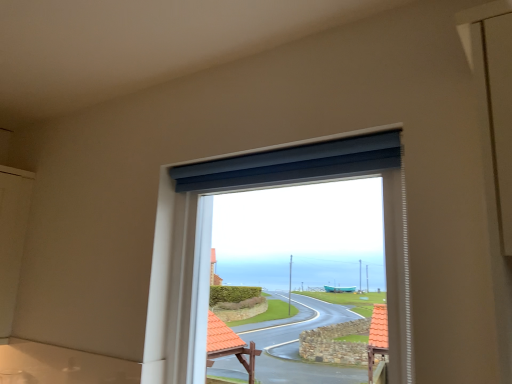
Question: In the image, is matte blue roller blind at center positioned in front of or behind matte blue curtain at upper center?

Choices:
 (A) behind
 (B) front

Answer: (B)

Question: Is matte blue roller blind at center taller or shorter than matte blue curtain at upper center?

Choices:
 (A) tall
 (B) short

Answer: (A)

Question: Is point (401, 326) positioned closer to the camera than point (185, 178)?

Choices:
 (A) closer
 (B) farther

Answer: (A)

Question: Would you say matte blue curtain at upper center is to the left or to the right of matte blue roller blind at center in the picture?

Choices:
 (A) left
 (B) right

Answer: (A)

Question: In terms of width, does matte blue curtain at upper center look wider or thinner when compared to matte blue roller blind at center?

Choices:
 (A) wide
 (B) thin

Answer: (B)

Question: Considering the positions of matte blue curtain at upper center and matte blue roller blind at center in the image, is matte blue curtain at upper center taller or shorter than matte blue roller blind at center?

Choices:
 (A) tall
 (B) short

Answer: (B)

Question: Is point pyautogui.click(x=361, y=137) closer or farther from the camera than point pyautogui.click(x=185, y=372)?

Choices:
 (A) closer
 (B) farther

Answer: (A)